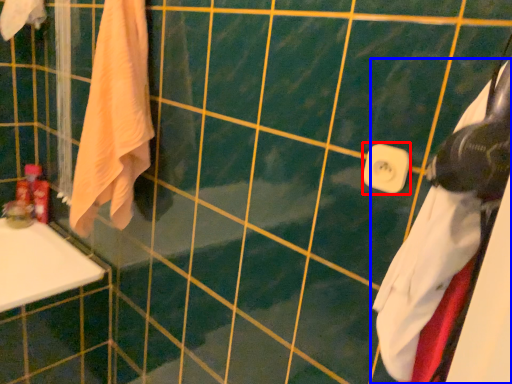
Question: Which point is closer to the camera, towel bar (highlighted by a red box) or towel (highlighted by a blue box)?

Choices:
 (A) towel bar
 (B) towel

Answer: (B)